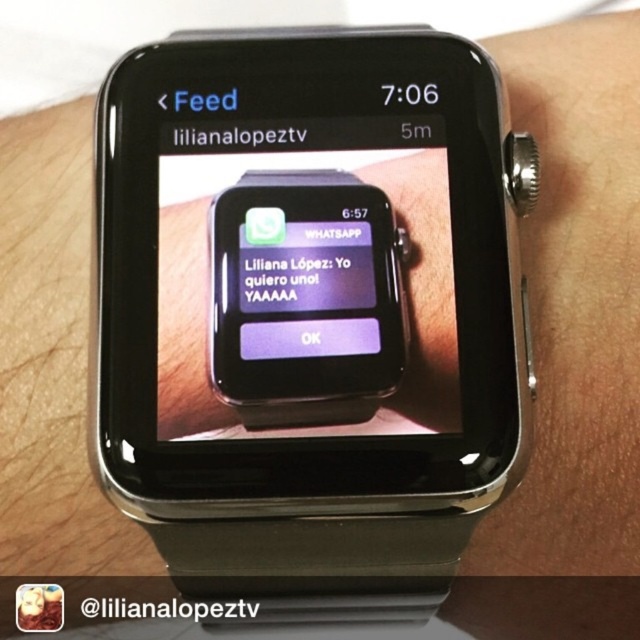
You are looking at a smartwatch screen and see the matte purple text at center and the black matte text at upper center. Which text is located below the other?

The matte purple text at center is positioned under the black matte text at upper center.